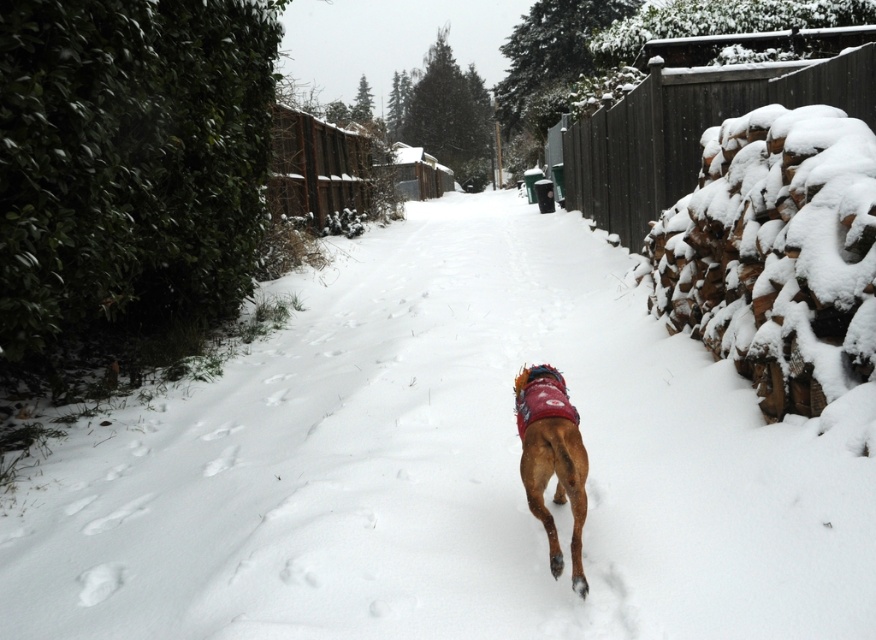
Is dark brown wooden fence at upper right wider than brown furry dog at center?

Yes.

Is point (641, 188) closer to camera compared to point (578, 442)?

No, it is not.

Where is `dark brown wooden fence at upper right`? Image resolution: width=876 pixels, height=640 pixels. dark brown wooden fence at upper right is located at coordinates (690, 128).

Which is above, white fluffy snow at center or brown furry dog at center?

white fluffy snow at center is higher up.

This screenshot has height=640, width=876. I want to click on white fluffy snow at center, so click(447, 468).

Where is `white fluffy snow at center`? Image resolution: width=876 pixels, height=640 pixels. white fluffy snow at center is located at coordinates (447, 468).

Can you confirm if white fluffy snow at center is taller than dark brown wooden fence at upper right?

Incorrect, white fluffy snow at center's height is not larger of dark brown wooden fence at upper right's.

Does point (152, 557) come behind point (863, 81)?

No, it is in front of (863, 81).

I want to click on white fluffy snow at center, so click(x=447, y=468).